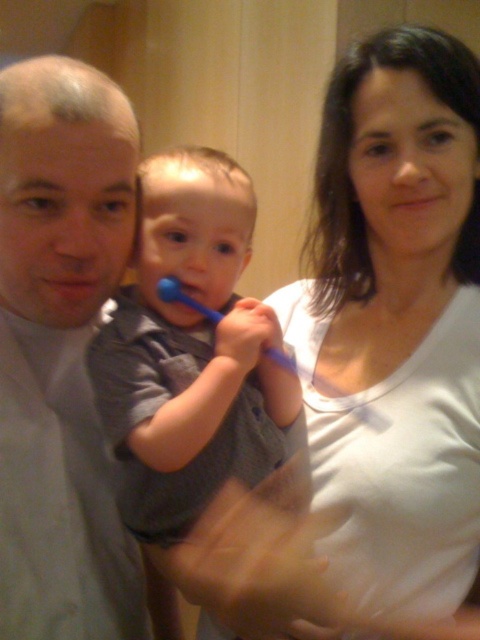
You are a photographer trying to adjust the lighting in the bathroom scene. You notice the white matte shirt at upper right and the matte gray shirt at left. Which shirt should you focus on to ensure proper exposure since it is closer to the camera?

The white matte shirt at upper right is taller than matte gray shirt at left, so it is closer to the camera. Therefore, you should focus on the white matte shirt at upper right to ensure proper exposure.